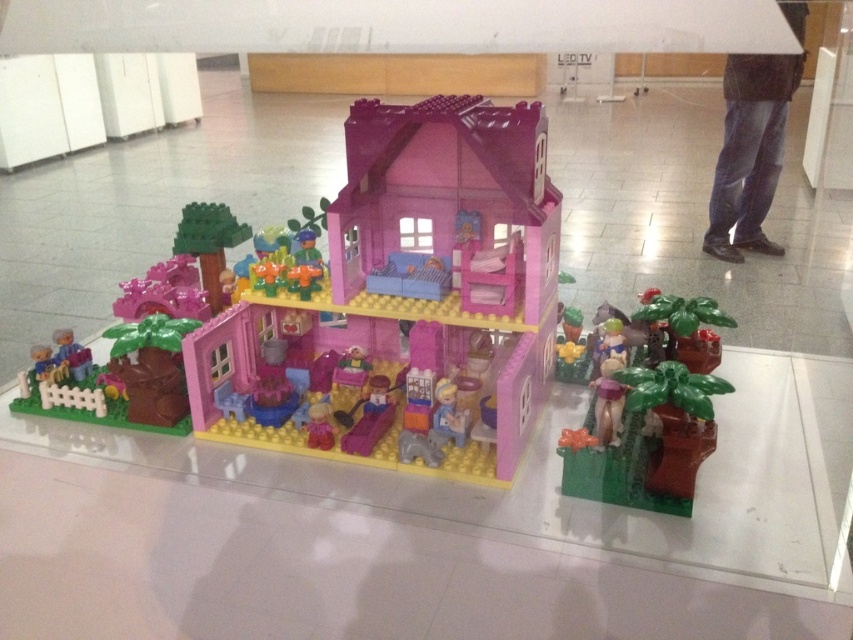
From the picture: Who is positioned more to the right, pink plastic house at center or green matte plant at lower right?

From the viewer's perspective, green matte plant at lower right appears more on the right side.

Which is in front, point (199, 365) or point (630, 468)?

Point (630, 468) is more forward.

Identify the location of pink plastic house at center. (410, 296).